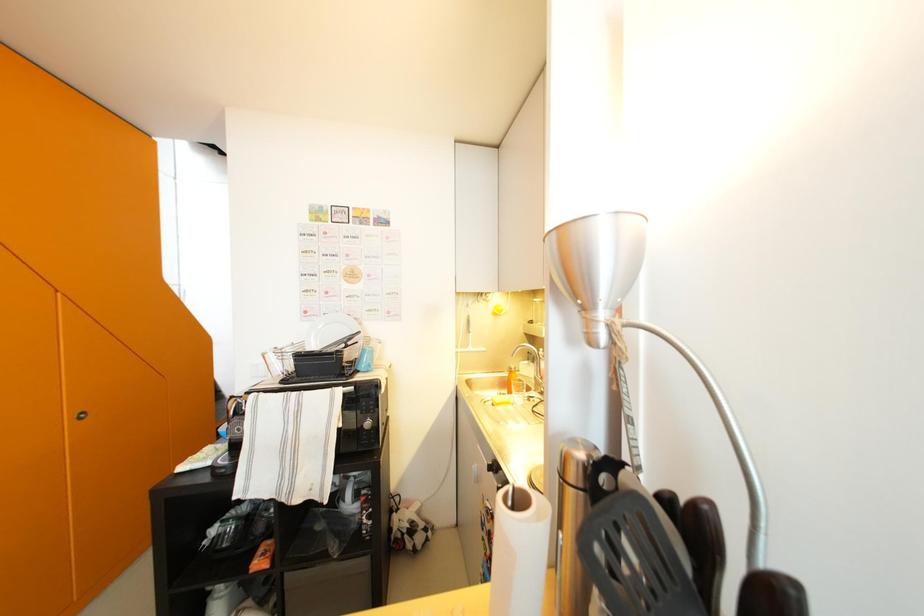
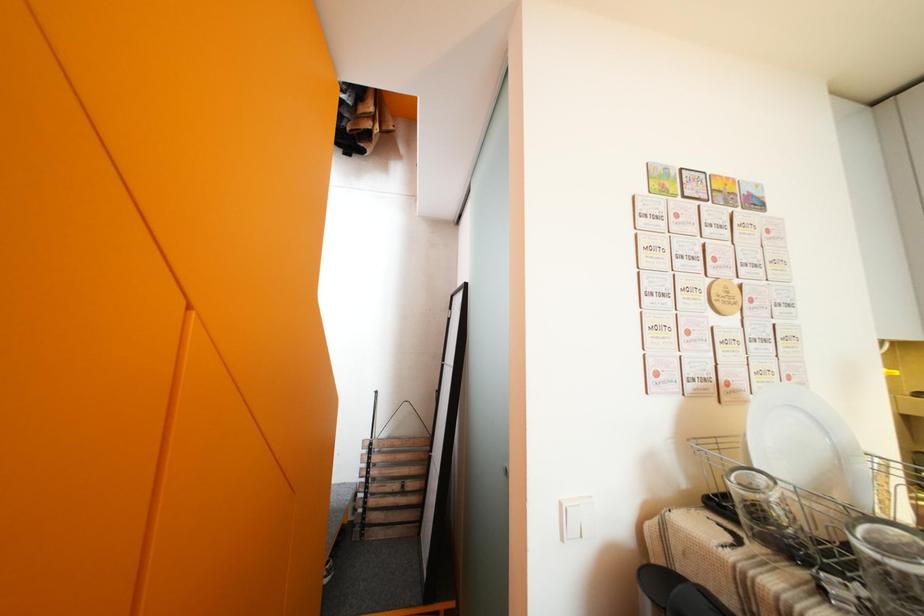
The images are taken continuously from a first-person perspective. In which direction are you moving?

The cameraman walked toward left, forward.